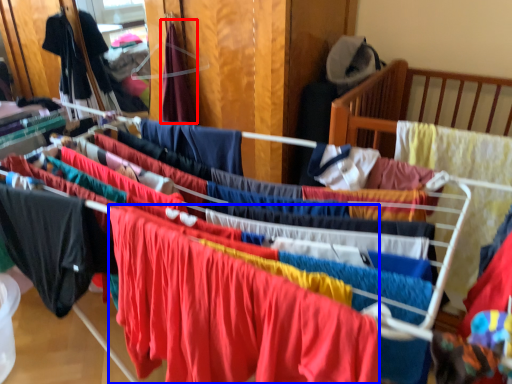
Question: Which object is further to the camera taking this photo, clothing (highlighted by a red box) or clothing (highlighted by a blue box)?

Choices:
 (A) clothing
 (B) clothing

Answer: (A)